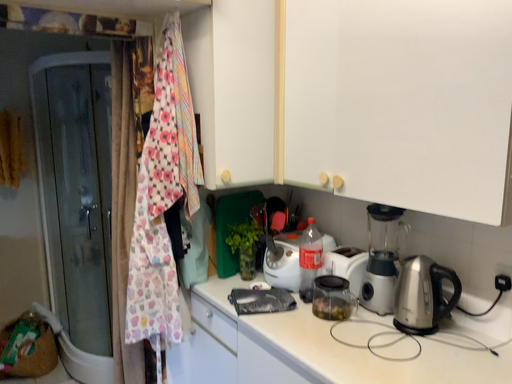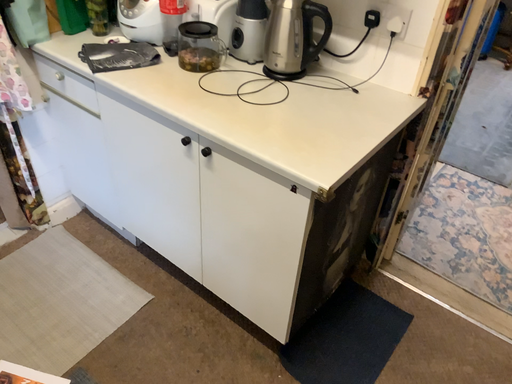
Question: Which way did the camera rotate in the video?

Choices:
 (A) rotated left
 (B) rotated right

Answer: (B)